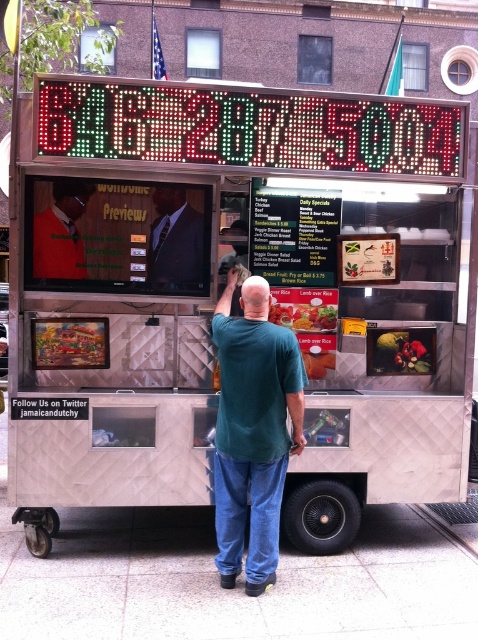
You are a customer standing in front of the food cart and see the green matte shirt at center and the matte black suit at center. Which one is closer to the ground?

The green matte shirt at center is located below the matte black suit at center, so it is closer to the ground.

You are standing in front of the food cart and see both the metallic silver food truck at center and the orange sweater at center. Which object is located to the right side from your perspective?

The metallic silver food truck at center is located to the right of the orange sweater at center, so the metallic silver food truck at center is on the right side.

You are a customer standing in front of the food cart and see the metallic silver food truck at center and the green matte shirt at center. Which object is located to the right of the other?

The metallic silver food truck at center is positioned on the right side of green matte shirt at center, so the metallic silver food truck at center is to the right of the green matte shirt at center.